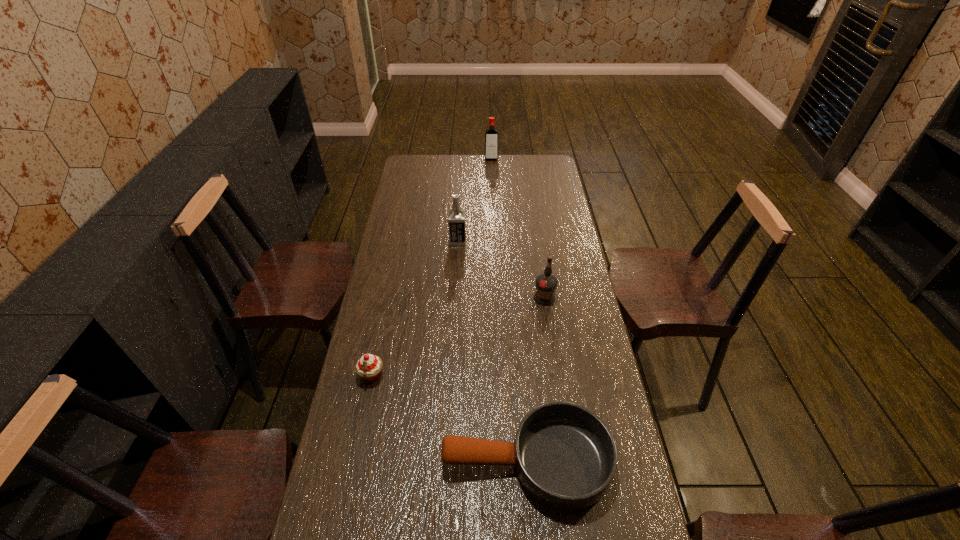
At what (x,y) coordinates should I click in order to perform the action: click on vacant space positioned 0.380m on the front and back of the farthest object. Please return your answer as a coordinate pair (x, y). The image size is (960, 540). Looking at the image, I should click on (492, 203).

You are a GUI agent. You are given a task and a screenshot of the screen. Output one action in this format:
    pyautogui.click(x=<x>, y=<y>)
    Task: Click on the vacant space located 0.340m on the front label of the second nearest vodka
    This screenshot has height=540, width=960.
    Given the screenshot: What is the action you would take?
    pyautogui.click(x=548, y=240)

Locate an element on the screen. This screenshot has width=960, height=540. vacant space located 0.320m on the front label of the third nearest object is located at coordinates (557, 384).

Image resolution: width=960 pixels, height=540 pixels. Identify the location of vacant space situated on the back of the second shortest object. (377, 349).

What are the coordinates of `vacant space located on the handle side of the shortest object` in the screenshot? It's located at coord(341,461).

Where is `free space located 0.250m on the handle side of the shortest object`? This screenshot has height=540, width=960. free space located 0.250m on the handle side of the shortest object is located at coordinates (348, 461).

Identify the location of free space located 0.280m on the handle side of the shortest object. (337, 461).

The width and height of the screenshot is (960, 540). I want to click on object situated at the far edge, so click(x=491, y=145).

Locate an element on the screen. This screenshot has width=960, height=540. object that is at the left edge is located at coordinates (368, 367).

Image resolution: width=960 pixels, height=540 pixels. Find the location of `vodka positioned at the right edge`. vodka positioned at the right edge is located at coordinates (546, 283).